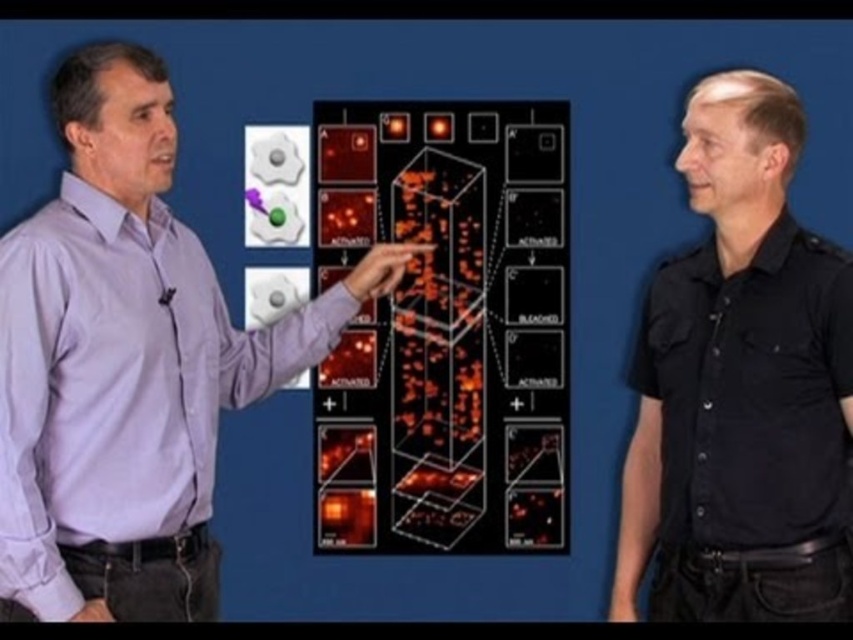
Is purple shirt at center positioned in front of black cotton shirt at right?

Yes, it is in front of black cotton shirt at right.

Which of these two, purple shirt at center or black cotton shirt at right, stands shorter?

black cotton shirt at right is shorter.

Does point (187, 493) come farther from viewer compared to point (659, 460)?

No, (187, 493) is closer to viewer.

Find the location of a particular element. Image resolution: width=853 pixels, height=640 pixels. purple shirt at center is located at coordinates (128, 364).